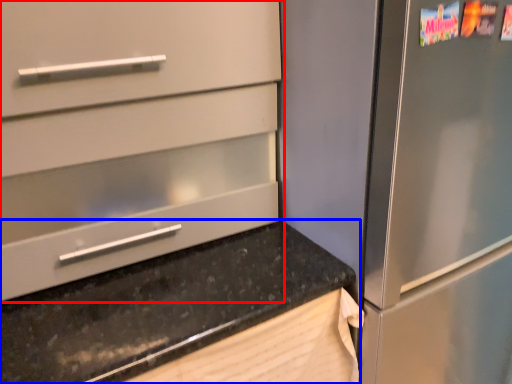
Question: Among these objects, which one is nearest to the camera, cabinetry (highlighted by a red box) or countertop (highlighted by a blue box)?

Choices:
 (A) cabinetry
 (B) countertop

Answer: (B)